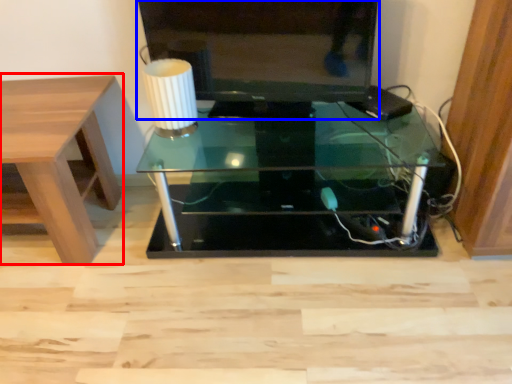
Question: Which point is closer to the camera, table (highlighted by a red box) or television (highlighted by a blue box)?

Choices:
 (A) table
 (B) television

Answer: (A)